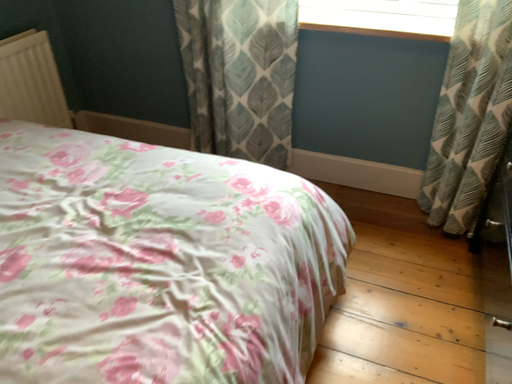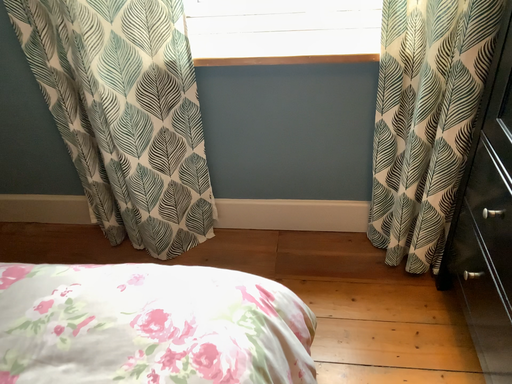
Question: Which way did the camera rotate in the video?

Choices:
 (A) rotated left
 (B) rotated right

Answer: (B)